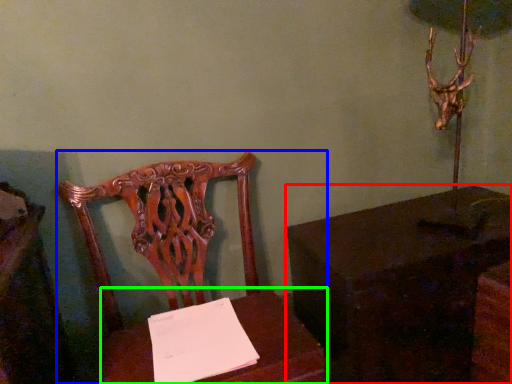
Question: Which object is the closest to the table (highlighted by a red box)? Choose among these: chair (highlighted by a blue box) or table (highlighted by a green box).

Choices:
 (A) chair
 (B) table

Answer: (B)